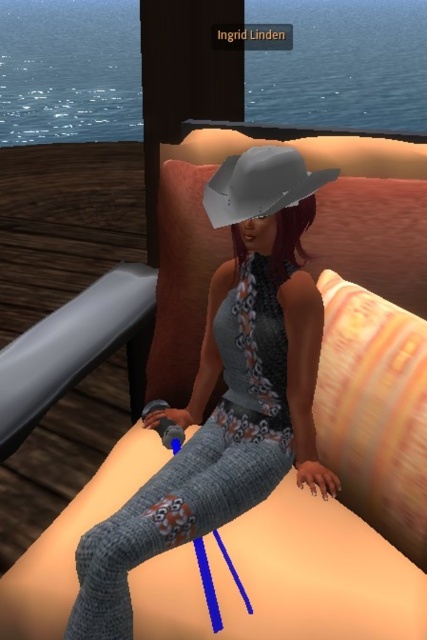
The character is sitting on a couch in a virtual environment. You need to place a small object exactly at point (228, 388). Which part of the character should you place it on?

The point (228, 388) is on the knitted gray pants at center, so you should place the object there.

You are a fashion designer analyzing the character in the image. Which item of clothing or accessory is larger in size between the knitted gray pants at center and the gray matte cowboy hat at center?

The knitted gray pants at center is larger in size than the gray matte cowboy hat at center according to the description.